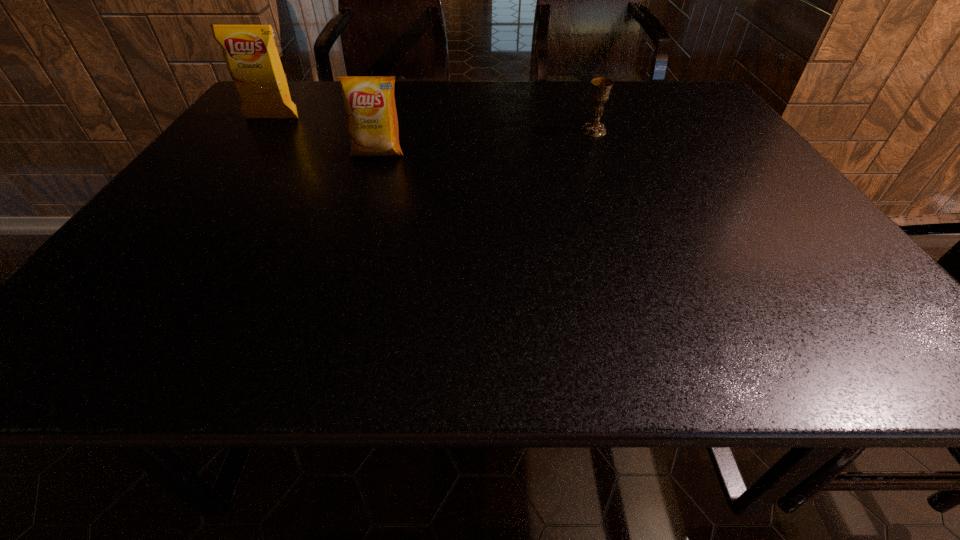
Where is `free spot that satisfies the following two spatial constraints: 1. on the front of the left crisp (potato chip) with the logo; 2. on the right side of the shortest object`? free spot that satisfies the following two spatial constraints: 1. on the front of the left crisp (potato chip) with the logo; 2. on the right side of the shortest object is located at coordinates (263, 131).

This screenshot has width=960, height=540. I want to click on free space that satisfies the following two spatial constraints: 1. on the front of the chalice with the logo; 2. on the left side of the tallest object, so click(263, 131).

At what (x,y) coordinates should I click in order to perform the action: click on vacant region that satisfies the following two spatial constraints: 1. on the front of the leftmost object with the logo; 2. on the right side of the shortest object. Please return your answer as a coordinate pair (x, y). The width and height of the screenshot is (960, 540). Looking at the image, I should click on (263, 131).